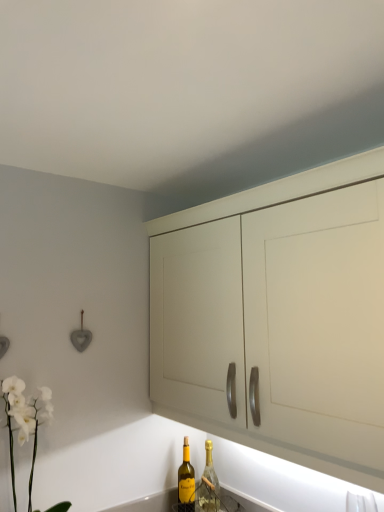
In order to face white matte orchid at lower left, should I rotate leftwards or rightwards?

To face it directly, rotate left by 20.383 degrees.

Image resolution: width=384 pixels, height=512 pixels. What do you see at coordinates (279, 316) in the screenshot? I see `matte white cabinet at center` at bounding box center [279, 316].

Image resolution: width=384 pixels, height=512 pixels. In order to click on white matte orchid at lower left in this screenshot , I will do `click(24, 421)`.

Who is shorter, gold foil champagne bottle at lower center, which is the first bottle in right-to-left order, or matte white cabinet at center?

gold foil champagne bottle at lower center, which is the first bottle in right-to-left order.

Which is correct: gold foil champagne bottle at lower center, which is the first bottle in right-to-left order, is inside matte white cabinet at center, or outside of it?

gold foil champagne bottle at lower center, which is the first bottle in right-to-left order, is outside matte white cabinet at center.

Which is more to the right, gold foil champagne bottle at lower center, which is the first bottle in right-to-left order, or matte white cabinet at center?

matte white cabinet at center.

In the image, is gold foil champagne bottle at lower center, which is the first bottle in right-to-left order, positioned in front of or behind matte white cabinet at center?

Clearly, gold foil champagne bottle at lower center, which is the first bottle in right-to-left order, is behind matte white cabinet at center.

Does yellow glass bottle at lower center, which is the 1th bottle from left to right, have a greater width compared to matte white cabinet at center?

Incorrect, the width of yellow glass bottle at lower center, which is the 1th bottle from left to right, does not surpass that of matte white cabinet at center.

Does yellow glass bottle at lower center, marked as the 2th bottle in a right-to-left arrangement, appear on the right side of matte white cabinet at center?

No.

Is yellow glass bottle at lower center, which is the 1th bottle from left to right, positioned with its back to matte white cabinet at center?

yellow glass bottle at lower center, which is the 1th bottle from left to right, does not have its back to matte white cabinet at center.

Considering the relative sizes of yellow glass bottle at lower center, marked as the 2th bottle in a right-to-left arrangement, and matte white cabinet at center in the image provided, is yellow glass bottle at lower center, marked as the 2th bottle in a right-to-left arrangement, taller than matte white cabinet at center?

No, yellow glass bottle at lower center, marked as the 2th bottle in a right-to-left arrangement, is not taller than matte white cabinet at center.

Are white matte orchid at lower left and matte white cabinet at center making contact?

No, white matte orchid at lower left is not in contact with matte white cabinet at center.

Which is closer, (8, 394) or (200, 303)?

Clearly, point (8, 394) is closer to the camera than point (200, 303).

From a real-world perspective, between white matte orchid at lower left and matte white cabinet at center, who is vertically higher?

matte white cabinet at center.

From a real-world perspective, between yellow glass bottle at lower center, marked as the 2th bottle in a right-to-left arrangement, and gold foil champagne bottle at lower center, the second bottle from the left, who is vertically higher?

gold foil champagne bottle at lower center, the second bottle from the left, from a real-world perspective.

Could you tell me if yellow glass bottle at lower center, which is the 1th bottle from left to right, is turned towards gold foil champagne bottle at lower center, which is the first bottle in right-to-left order?

No, yellow glass bottle at lower center, which is the 1th bottle from left to right, is not turned towards gold foil champagne bottle at lower center, which is the first bottle in right-to-left order.

How many degrees apart are the facing directions of yellow glass bottle at lower center, which is the 1th bottle from left to right, and gold foil champagne bottle at lower center, the second bottle from the left?

16.7 degrees.

Can you confirm if yellow glass bottle at lower center, marked as the 2th bottle in a right-to-left arrangement, is thinner than gold foil champagne bottle at lower center, the second bottle from the left?

No, yellow glass bottle at lower center, marked as the 2th bottle in a right-to-left arrangement, is not thinner than gold foil champagne bottle at lower center, the second bottle from the left.

Looking at the image, does matte white cabinet at center seem bigger or smaller compared to gold foil champagne bottle at lower center, which is the first bottle in right-to-left order?

Clearly, matte white cabinet at center is larger in size than gold foil champagne bottle at lower center, which is the first bottle in right-to-left order.

What's the angular difference between matte white cabinet at center and gold foil champagne bottle at lower center, the second bottle from the left,'s facing directions?

The facing directions of matte white cabinet at center and gold foil champagne bottle at lower center, the second bottle from the left, are 48.3 degrees apart.

Is point (353, 387) closer to camera compared to point (217, 509)?

That is True.

Would you say matte white cabinet at center is a long distance from gold foil champagne bottle at lower center, the second bottle from the left?

No, matte white cabinet at center is not far away from gold foil champagne bottle at lower center, the second bottle from the left.

Are matte white cabinet at center and white matte orchid at lower left far apart?

No.

In the image, is matte white cabinet at center positioned in front of or behind white matte orchid at lower left?

matte white cabinet at center is in front of white matte orchid at lower left.

Can you confirm if matte white cabinet at center is positioned to the left of white matte orchid at lower left?

In fact, matte white cabinet at center is to the right of white matte orchid at lower left.

From a real-world perspective, which is physically below, matte white cabinet at center or white matte orchid at lower left?

white matte orchid at lower left is physically lower.

Is gold foil champagne bottle at lower center, the second bottle from the left, completely or partially outside of yellow glass bottle at lower center, marked as the 2th bottle in a right-to-left arrangement?

Indeed, gold foil champagne bottle at lower center, the second bottle from the left, is completely outside yellow glass bottle at lower center, marked as the 2th bottle in a right-to-left arrangement.

Which object is positioned more to the left, gold foil champagne bottle at lower center, the second bottle from the left, or yellow glass bottle at lower center, marked as the 2th bottle in a right-to-left arrangement?

Positioned to the left is yellow glass bottle at lower center, marked as the 2th bottle in a right-to-left arrangement.

Is point (198, 510) positioned in front of point (189, 507)?

No, (198, 510) is behind (189, 507).

The image size is (384, 512). What are the coordinates of `bottle that appears behind the yellow glass bottle at lower center, which is the 1th bottle from left to right` in the screenshot? It's located at (208, 485).

The width and height of the screenshot is (384, 512). I want to click on cabinetry above the gold foil champagne bottle at lower center, which is the first bottle in right-to-left order (from the image's perspective), so (x=279, y=316).

This screenshot has width=384, height=512. I want to click on cabinetry on the right of yellow glass bottle at lower center, which is the 1th bottle from left to right, so click(279, 316).

When comparing their distances from gold foil champagne bottle at lower center, the second bottle from the left, does matte white cabinet at center or white matte orchid at lower left seem further?

Based on the image, matte white cabinet at center appears to be further to gold foil champagne bottle at lower center, the second bottle from the left.

Based on their spatial positions, is yellow glass bottle at lower center, marked as the 2th bottle in a right-to-left arrangement, or matte white cabinet at center closer to white matte orchid at lower left?

Based on the image, yellow glass bottle at lower center, marked as the 2th bottle in a right-to-left arrangement, appears to be nearer to white matte orchid at lower left.

Estimate the real-world distances between objects in this image. Which object is closer to matte white cabinet at center, yellow glass bottle at lower center, which is the 1th bottle from left to right, or gold foil champagne bottle at lower center, the second bottle from the left?

The object closer to matte white cabinet at center is yellow glass bottle at lower center, which is the 1th bottle from left to right.

Estimate the real-world distances between objects in this image. Which object is closer to gold foil champagne bottle at lower center, which is the first bottle in right-to-left order, yellow glass bottle at lower center, marked as the 2th bottle in a right-to-left arrangement, or white matte orchid at lower left?

yellow glass bottle at lower center, marked as the 2th bottle in a right-to-left arrangement, lies closer to gold foil champagne bottle at lower center, which is the first bottle in right-to-left order, than the other object.

When comparing their distances from gold foil champagne bottle at lower center, which is the first bottle in right-to-left order, does yellow glass bottle at lower center, which is the 1th bottle from left to right, or matte white cabinet at center seem further?

matte white cabinet at center lies further to gold foil champagne bottle at lower center, which is the first bottle in right-to-left order, than the other object.

Which object lies further to the anchor point matte white cabinet at center, white matte orchid at lower left or gold foil champagne bottle at lower center, which is the first bottle in right-to-left order?

Based on the image, gold foil champagne bottle at lower center, which is the first bottle in right-to-left order, appears to be further to matte white cabinet at center.

When comparing their distances from matte white cabinet at center, does gold foil champagne bottle at lower center, the second bottle from the left, or yellow glass bottle at lower center, which is the 1th bottle from left to right, seem closer?

yellow glass bottle at lower center, which is the 1th bottle from left to right, is closer to matte white cabinet at center.

When comparing their distances from yellow glass bottle at lower center, which is the 1th bottle from left to right, does matte white cabinet at center or gold foil champagne bottle at lower center, the second bottle from the left, seem closer?

Among the two, gold foil champagne bottle at lower center, the second bottle from the left, is located nearer to yellow glass bottle at lower center, which is the 1th bottle from left to right.

This screenshot has height=512, width=384. I want to click on bottle between matte white cabinet at center and gold foil champagne bottle at lower center, the second bottle from the left, in the front-back direction, so click(186, 481).

The width and height of the screenshot is (384, 512). What are the coordinates of `floral arrangement between matte white cabinet at center and yellow glass bottle at lower center, marked as the 2th bottle in a right-to-left arrangement, in the front-back direction` in the screenshot? It's located at (24, 421).

This screenshot has height=512, width=384. What are the coordinates of `bottle between white matte orchid at lower left and gold foil champagne bottle at lower center, which is the first bottle in right-to-left order, from front to back` in the screenshot? It's located at (186, 481).

The width and height of the screenshot is (384, 512). I want to click on floral arrangement positioned between matte white cabinet at center and gold foil champagne bottle at lower center, the second bottle from the left, from near to far, so click(24, 421).